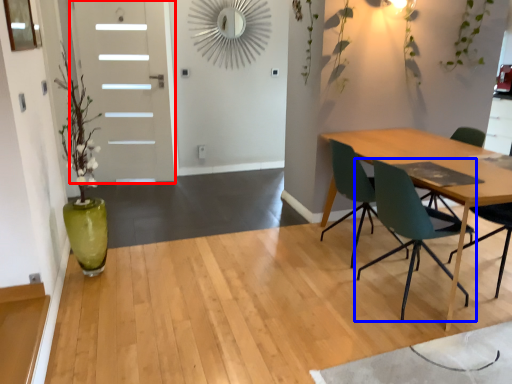
Question: Which object is closer to the camera taking this photo, door (highlighted by a red box) or chair (highlighted by a blue box)?

Choices:
 (A) door
 (B) chair

Answer: (B)